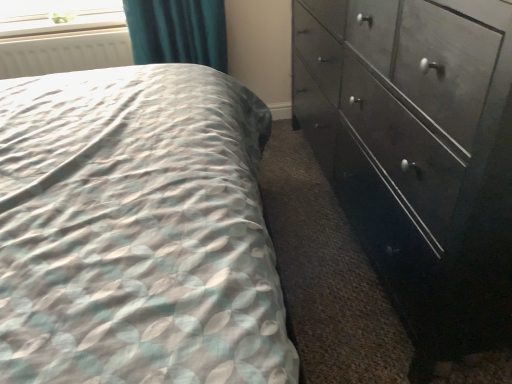
The height and width of the screenshot is (384, 512). In order to click on empty space that is ontop of clear plastic window screen at upper left (from a real-world perspective) in this screenshot , I will do `click(63, 20)`.